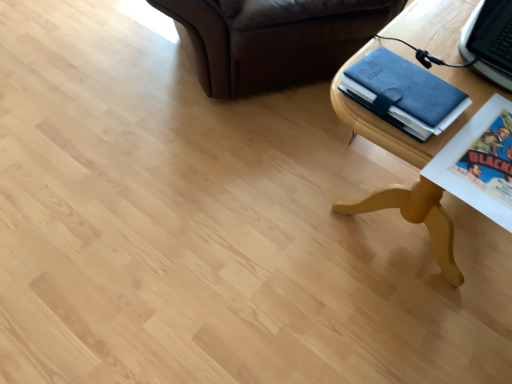
Locate an element on the screen. This screenshot has height=384, width=512. spots to the right of blue leather binder at upper right is located at coordinates (478, 107).